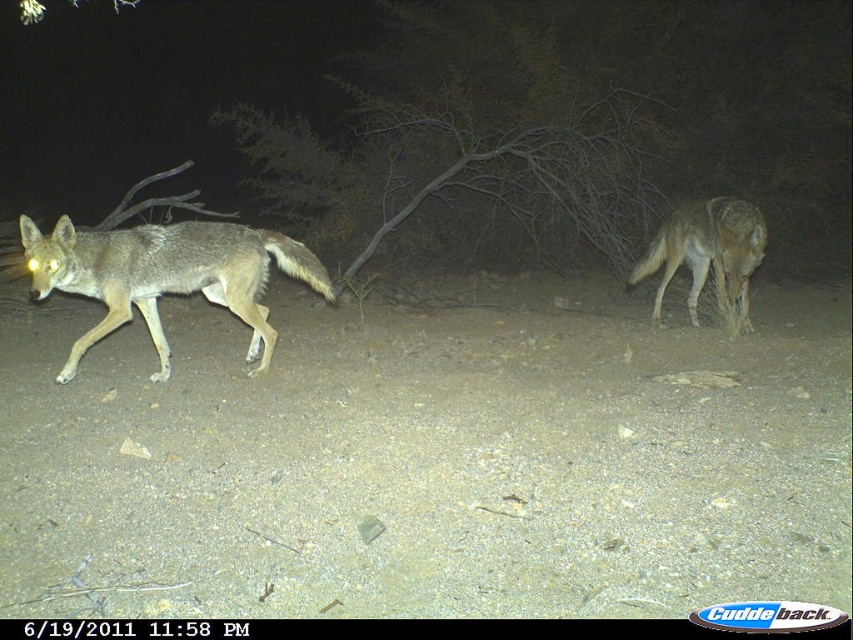
From the picture: You are a wildlife researcher observing two coyotes in the dark night environment. You notice the furry gray coyote at left and the brown fur coyote at right. Which coyote appears taller based on their positions in the image?

The brown fur coyote at right appears taller because the furry gray coyote at left has a lesser height compared to it.

Based on the photo, you are a wildlife researcher observing two coyotes in a night vision camera. The scene shows a furry gray coyote at left and a brown fur coyote at right. Which coyote appears wider in the image?

The furry gray coyote at left appears wider than the brown fur coyote at right in the image.

You are a wildlife researcher observing two coyotes in the night. You notice a furry gray coyote at left and a brown fur coyote at right. Based on their positions, which coyote is closer to the ground?

The furry gray coyote at left is closer to the ground because it is located below the brown fur coyote at right.